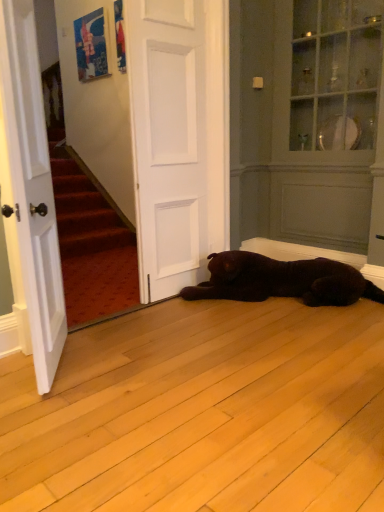
You are a GUI agent. You are given a task and a screenshot of the screen. Output one action in this format:
    pyautogui.click(x=<x>, y=<y>)
    Task: Click on the vacant space to the right of white wood door at left, the 2th door from the right
    
    Given the screenshot: What is the action you would take?
    pyautogui.click(x=117, y=365)